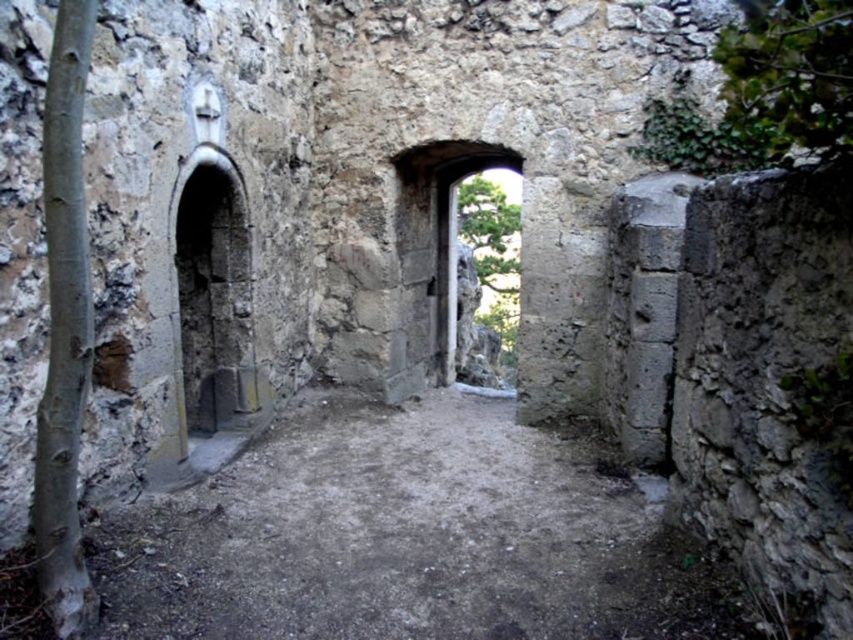
Question: Can you confirm if rusty stone arch at left is positioned above stone archway at center?

Choices:
 (A) yes
 (B) no

Answer: (B)

Question: Which point is farther from the camera taking this photo?

Choices:
 (A) (230, 212)
 (B) (415, 307)

Answer: (B)

Question: Which point is closer to the camera taking this photo?

Choices:
 (A) (424, 170)
 (B) (178, 173)

Answer: (B)

Question: Which object is farther from the camera taking this photo?

Choices:
 (A) rusty stone arch at left
 (B) stone archway at center

Answer: (B)

Question: In this image, where is rusty stone arch at left located relative to stone archway at center?

Choices:
 (A) left
 (B) right

Answer: (A)

Question: Can you confirm if rusty stone arch at left is positioned to the right of stone archway at center?

Choices:
 (A) yes
 (B) no

Answer: (B)